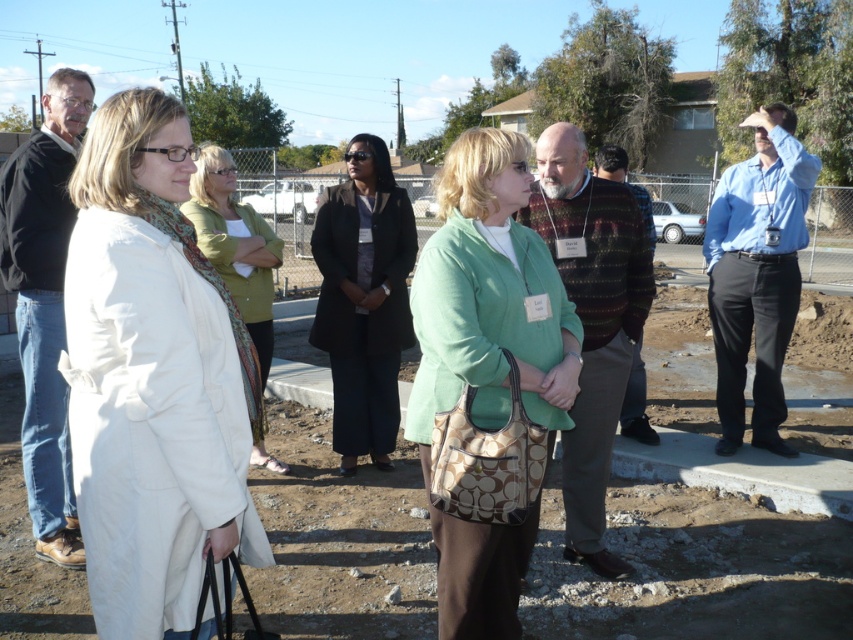
Question: Among these objects, which one is farthest from the camera?

Choices:
 (A) dark gray coat at center
 (B) white fabric coat at left

Answer: (A)

Question: Does white fabric coat at left have a smaller size compared to white matte coat at center?

Choices:
 (A) no
 (B) yes

Answer: (A)

Question: Is white fabric coat at left thinner than white matte coat at center?

Choices:
 (A) yes
 (B) no

Answer: (B)

Question: In this image, where is white fabric coat at left located relative to dark gray coat at center?

Choices:
 (A) right
 (B) left

Answer: (B)

Question: Based on their relative distances, which object is nearer to the white matte coat at center?

Choices:
 (A) green matte sweater at center
 (B) dark gray coat at center
 (C) white fabric coat at left

Answer: (B)

Question: Which point appears closest to the camera in this image?

Choices:
 (A) (343, 401)
 (B) (181, 369)
 (C) (260, 237)
 (D) (432, 516)

Answer: (B)